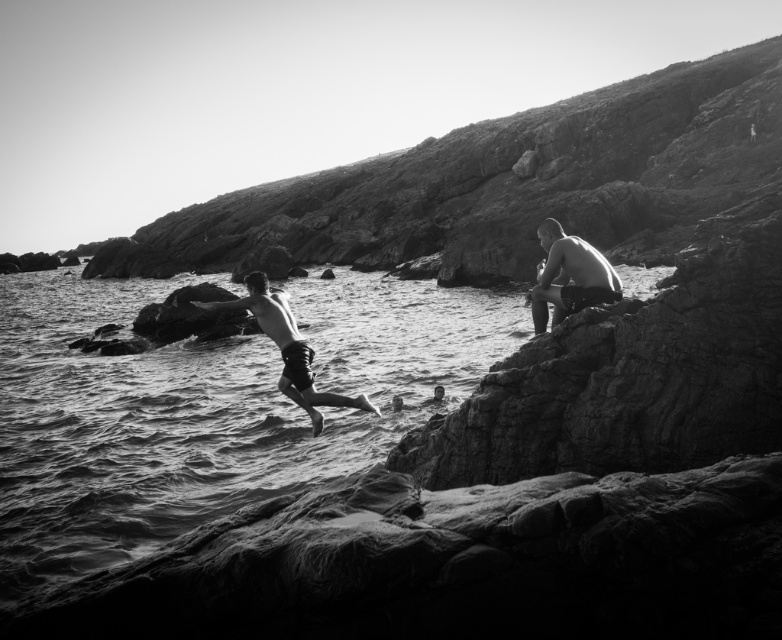
You are a photographer trying to capture both the smooth skin man at right and the smooth skin man at center in a single frame. Since the camera can only focus on one subject at a time, which subject should you focus on to ensure the taller person is in focus?

The smooth skin man at center is taller than the smooth skin man at right. To ensure the taller person is in focus, you should focus on the smooth skin man at center.